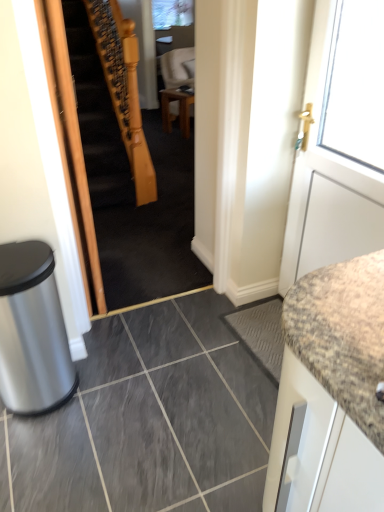
Question: Does silver metallic trash bin at lower left have a greater width compared to wooden table at center?

Choices:
 (A) no
 (B) yes

Answer: (A)

Question: Is silver metallic trash bin at lower left outside wooden table at center?

Choices:
 (A) yes
 (B) no

Answer: (A)

Question: Would you consider silver metallic trash bin at lower left to be distant from wooden table at center?

Choices:
 (A) no
 (B) yes

Answer: (B)

Question: Would you say wooden table at center is part of silver metallic trash bin at lower left's contents?

Choices:
 (A) no
 (B) yes

Answer: (A)

Question: Is silver metallic trash bin at lower left at the right side of wooden table at center?

Choices:
 (A) yes
 (B) no

Answer: (B)

Question: From a real-world perspective, is white matte door at right physically located above or below wooden table at center?

Choices:
 (A) below
 (B) above

Answer: (B)

Question: Based on their sizes in the image, would you say white matte door at right is bigger or smaller than wooden table at center?

Choices:
 (A) big
 (B) small

Answer: (A)

Question: Looking at their shapes, would you say white matte door at right is wider or thinner than wooden table at center?

Choices:
 (A) thin
 (B) wide

Answer: (A)

Question: Is white matte door at right taller or shorter than wooden table at center?

Choices:
 (A) short
 (B) tall

Answer: (B)

Question: From a real-world perspective, is gray matte tile at center positioned above or below wooden table at center?

Choices:
 (A) below
 (B) above

Answer: (A)

Question: Is gray matte tile at center taller or shorter than wooden table at center?

Choices:
 (A) tall
 (B) short

Answer: (B)

Question: From the image's perspective, is gray matte tile at center located above or below wooden table at center?

Choices:
 (A) above
 (B) below

Answer: (B)

Question: Is gray matte tile at center spatially inside wooden table at center, or outside of it?

Choices:
 (A) outside
 (B) inside

Answer: (A)

Question: In terms of width, does wooden staircase at center look wider or thinner when compared to white matte door at right?

Choices:
 (A) thin
 (B) wide

Answer: (B)

Question: Is wooden staircase at center spatially inside white matte door at right, or outside of it?

Choices:
 (A) inside
 (B) outside

Answer: (B)